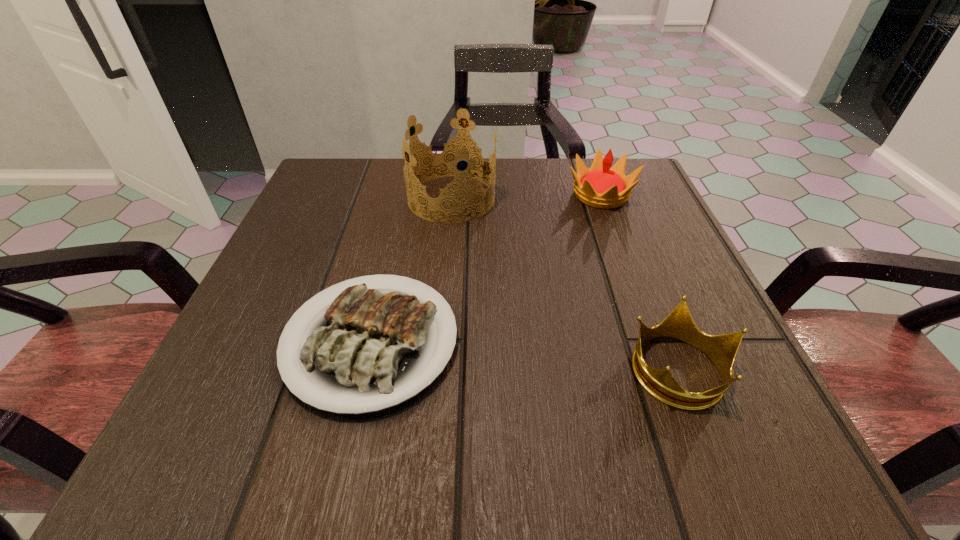
The height and width of the screenshot is (540, 960). I want to click on the tallest object, so click(449, 154).

The height and width of the screenshot is (540, 960). I want to click on the leftmost crown, so click(449, 154).

Identify the location of the second tallest object. (601, 186).

At what (x,y) coordinates should I click in order to perform the action: click on the second shortest object. Please return your answer as a coordinate pair (x, y). The image size is (960, 540). Looking at the image, I should click on (679, 325).

Find the location of a particular element. the shortest crown is located at coordinates (679, 325).

You are a GUI agent. You are given a task and a screenshot of the screen. Output one action in this format:
    pyautogui.click(x=<x>, y=<y>)
    Task: Click on the shortest object
    This screenshot has height=540, width=960.
    Given the screenshot: What is the action you would take?
    [364, 354]

Identify the location of vacant space located 0.110m on the front of the leftmost crown. (446, 261).

Locate an element on the screen. free space located 0.310m on the front of the second shortest crown is located at coordinates (652, 334).

Identify the location of free region located 0.180m on the back of the shortest crown. (634, 254).

Find the location of a particular element. free spot located 0.380m on the right of the shortest object is located at coordinates [x=730, y=342].